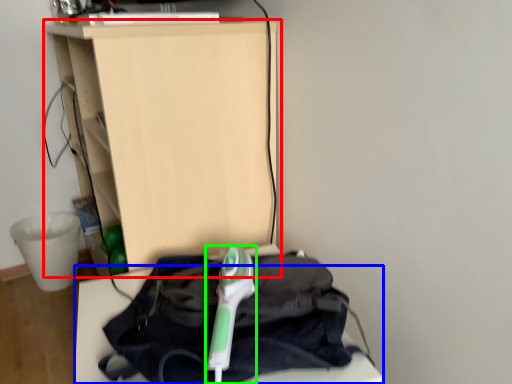
Question: Which object is positioned closest to furniture (highlighted by a red box)? Select from furniture (highlighted by a blue box) and equipment (highlighted by a green box).

Choices:
 (A) furniture
 (B) equipment

Answer: (B)